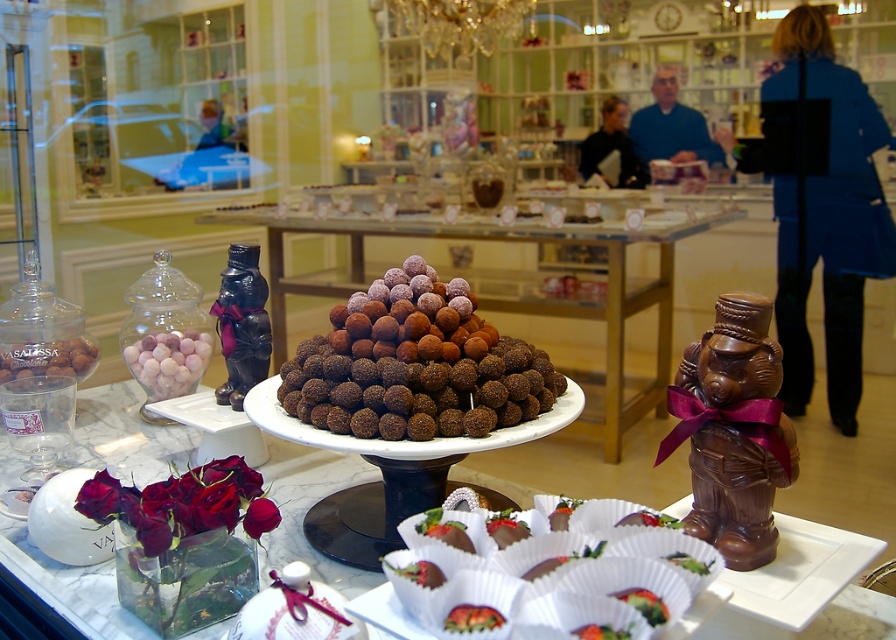
You are a customer in the chocolate shop and want to place an order. You have a small gift box that is 16 inches long. Can you fit both the brown chocolate truffles at center and the smooth black coat at upper center into the box without moving them from their current positions?

The brown chocolate truffles at center and the smooth black coat at upper center are 17.40 inches apart. Since the distance between them is greater than the 16 inches length of the box, they cannot both fit into the box without moving them.

You are a customer in the chocolate shop and want to find the blue fabric coat at upper right and the smooth black coat at upper center. According to the scene, which coat is located to the right of the other?

The blue fabric coat at upper right is positioned on the right side of smooth black coat at upper center, so the blue fabric coat at upper right is to the right of the smooth black coat at upper center.